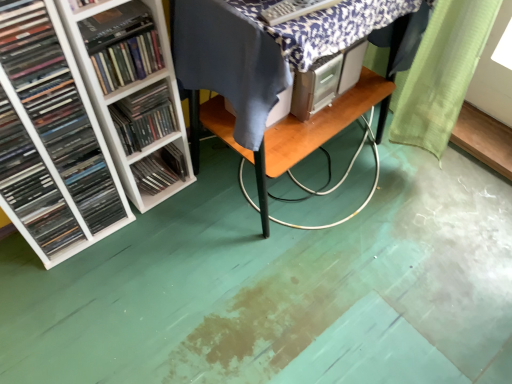
Question: From a real-world perspective, is white plastic shelf at left, marked as the 1th book in a right-to-left arrangement, positioned above or below white plastic shelf at left, marked as the second shelf in a front-to-back arrangement?

Choices:
 (A) above
 (B) below

Answer: (A)

Question: Visually, is white plastic shelf at left, marked as the 1th book in a right-to-left arrangement, positioned to the left or to the right of white plastic shelf at left, marked as the second shelf in a front-to-back arrangement?

Choices:
 (A) right
 (B) left

Answer: (A)

Question: Estimate the real-world distances between objects in this image. Which object is closer to the wooden table at center?

Choices:
 (A) white plastic shelf at left, the third book when ordered from left to right
 (B) white plastic shelf at left, the first shelf positioned from the front
 (C) hardcover book at left
 (D) white plastic shelf at left, marked as the second shelf in a front-to-back arrangement
 (E) matte black books at left, positioned as the 1th book in left-to-right order

Answer: (A)

Question: Which object is positioned farthest from the matte black books at left, positioned as the 1th book in left-to-right order?

Choices:
 (A) white plastic shelves at left, which is the 2th book in right-to-left order
 (B) white plastic shelf at left, positioned as the 2th shelf in back-to-front order
 (C) white plastic shelf at left, marked as the second shelf in a front-to-back arrangement
 (D) white plastic shelf at left, the third book when ordered from left to right
 (E) wooden table at center

Answer: (E)